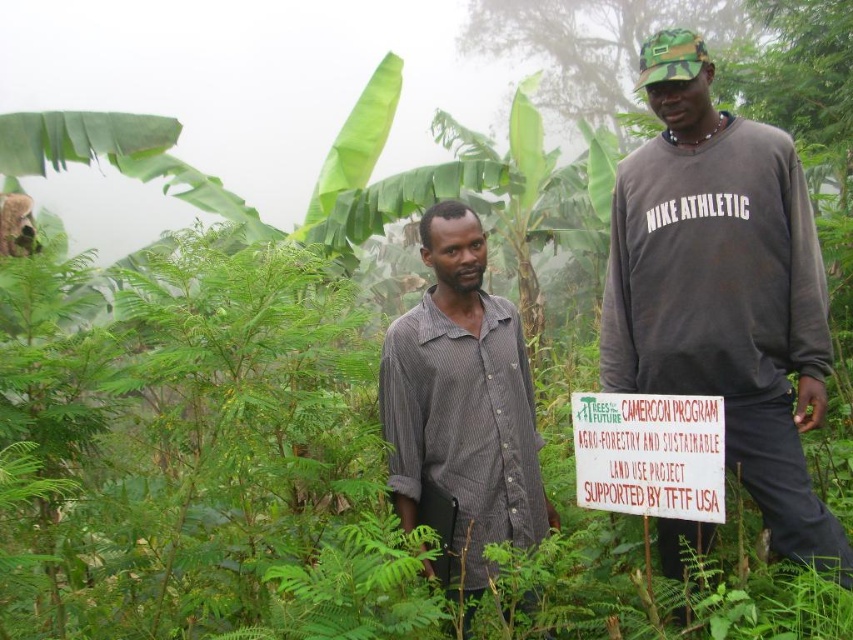
Question: Among these objects, which one is nearest to the camera?

Choices:
 (A) white paper sign at center
 (B) gray striped shirt at center
 (C) dark gray sweatshirt at center

Answer: (B)

Question: Is gray striped shirt at center above white paper sign at center?

Choices:
 (A) yes
 (B) no

Answer: (A)

Question: Can you confirm if dark gray sweatshirt at center is positioned below white paper sign at center?

Choices:
 (A) no
 (B) yes

Answer: (A)

Question: Can you confirm if dark gray sweatshirt at center is positioned below gray striped shirt at center?

Choices:
 (A) yes
 (B) no

Answer: (B)

Question: Considering the real-world distances, which object is closest to the white paper sign at center?

Choices:
 (A) gray striped shirt at center
 (B) dark gray sweatshirt at center

Answer: (B)

Question: Estimate the real-world distances between objects in this image. Which object is closer to the white paper sign at center?

Choices:
 (A) gray striped shirt at center
 (B) dark gray sweatshirt at center

Answer: (B)